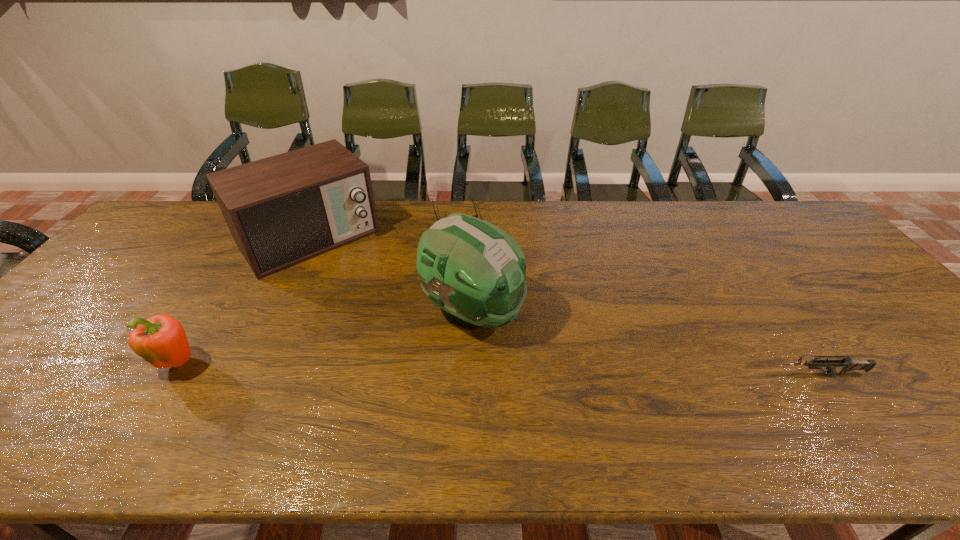
Find the location of a particular element. vacant position in the image that satisfies the following two spatial constraints: 1. on the front side of the shortest object; 2. aimed along the barrel of the gun is located at coordinates (443, 374).